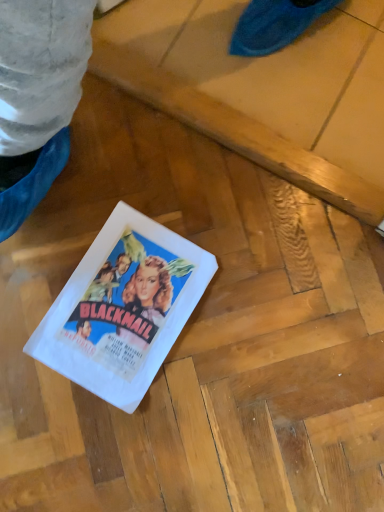
Identify the location of unoccupied region to the right of white matte book at center. (241, 344).